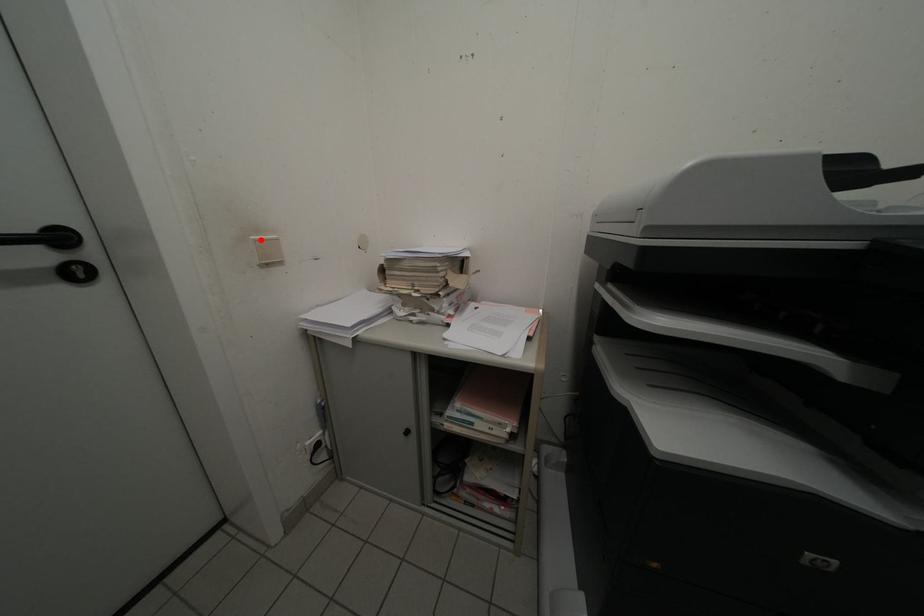
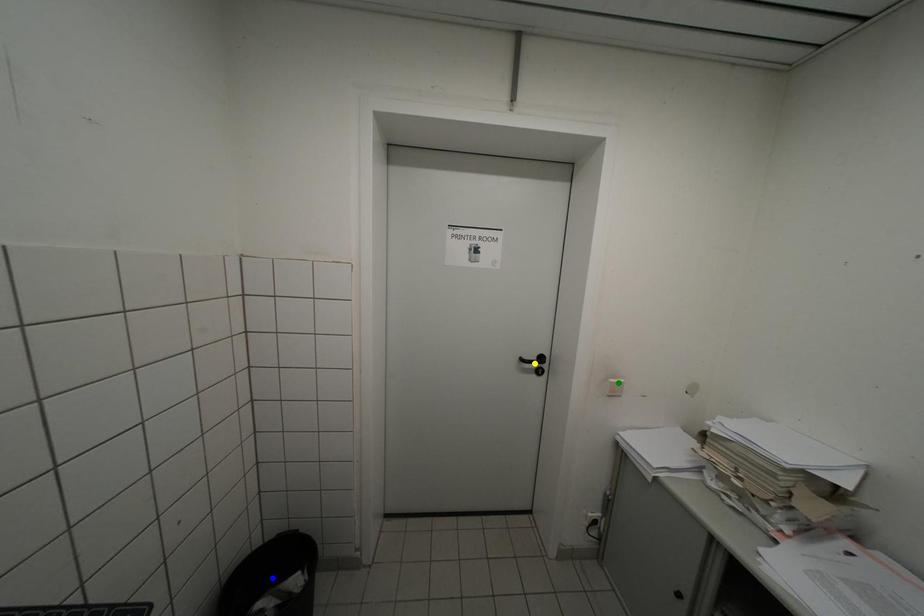
Question: I am providing you with two images of the same scene from different viewpoints. A red point is marked on the first image. You are given multiple points on the second image. Which point in image 2 represents the same 3d spot as the red point in image 1?

Choices:
 (A) green point
 (B) yellow point
 (C) blue point

Answer: (A)